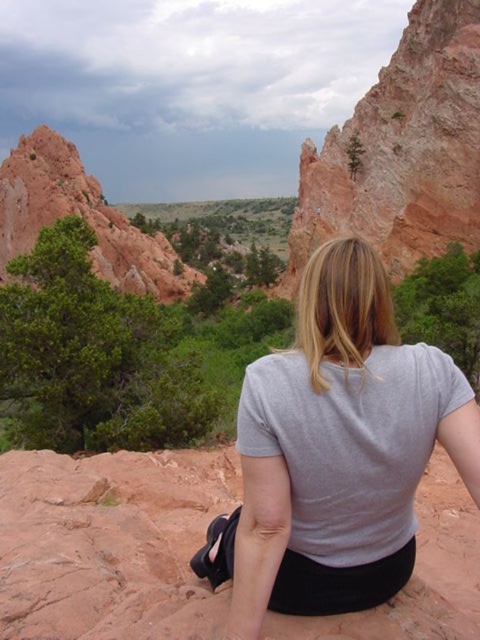
Question: Does rustic sandstone cliff at upper right have a greater width compared to matte reddish rock formation at upper left?

Choices:
 (A) no
 (B) yes

Answer: (A)

Question: Which of the following is the farthest from the observer?

Choices:
 (A) matte reddish rock formation at upper left
 (B) rustic sandstone cliff at upper right
 (C) gray cotton shirt at center

Answer: (A)

Question: Can you confirm if rustic sandstone cliff at upper right is thinner than matte reddish rock formation at upper left?

Choices:
 (A) yes
 (B) no

Answer: (A)

Question: Which of the following is the closest to the observer?

Choices:
 (A) matte reddish rock formation at upper left
 (B) rustic sandstone cliff at upper right
 (C) gray cotton shirt at center

Answer: (C)

Question: Estimate the real-world distances between objects in this image. Which object is farther from the matte reddish rock formation at upper left?

Choices:
 (A) rustic sandstone cliff at upper right
 (B) gray cotton shirt at center

Answer: (B)

Question: Does rustic sandstone cliff at upper right lie in front of matte reddish rock formation at upper left?

Choices:
 (A) yes
 (B) no

Answer: (A)